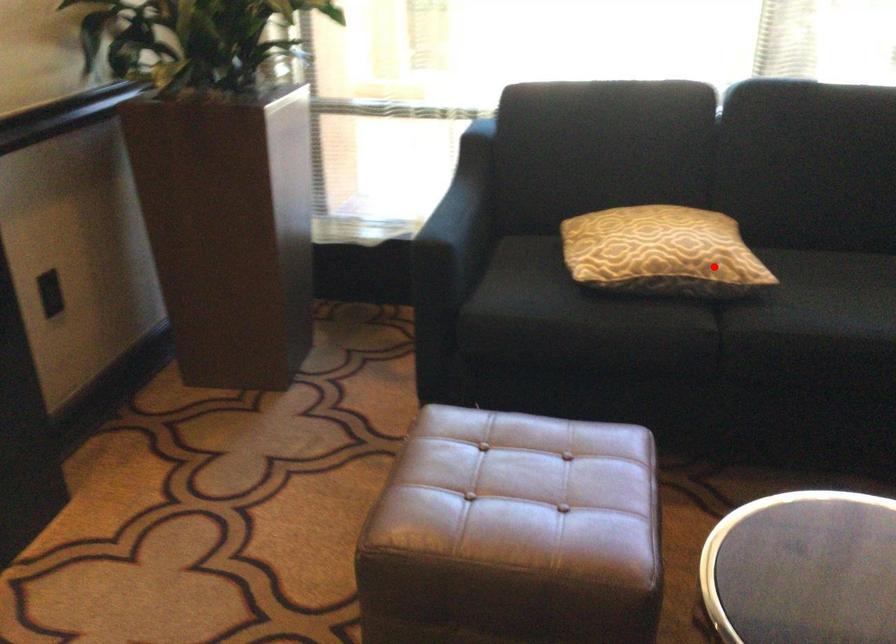
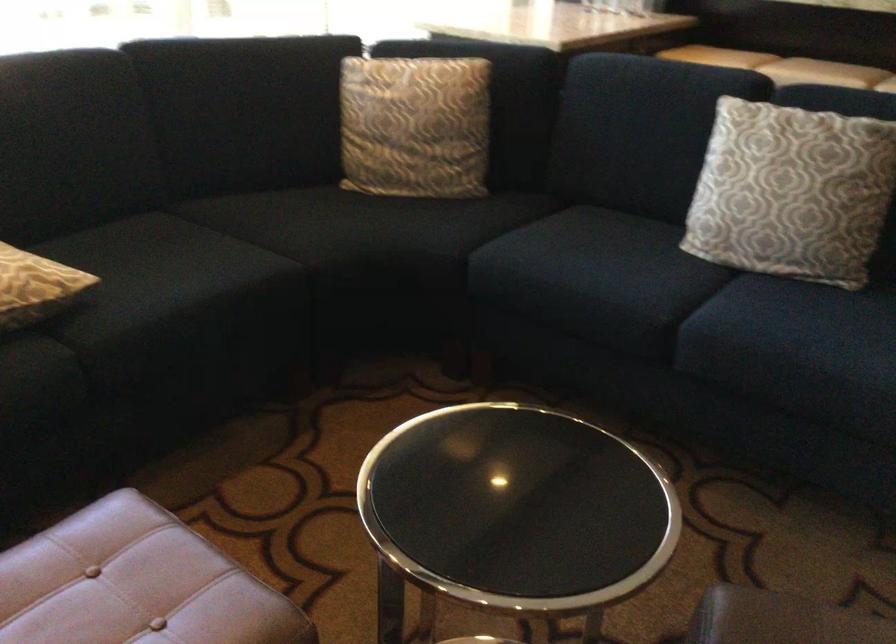
Where in the second image is the point corresponding to the highlighted location from the first image?

(35, 287)